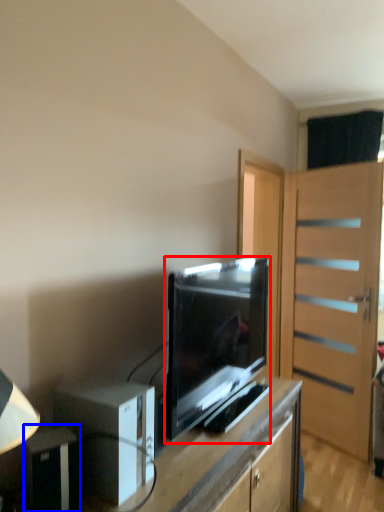
Question: Among these objects, which one is farthest to the camera, television (highlighted by a red box) or appliance (highlighted by a blue box)?

Choices:
 (A) television
 (B) appliance

Answer: (A)